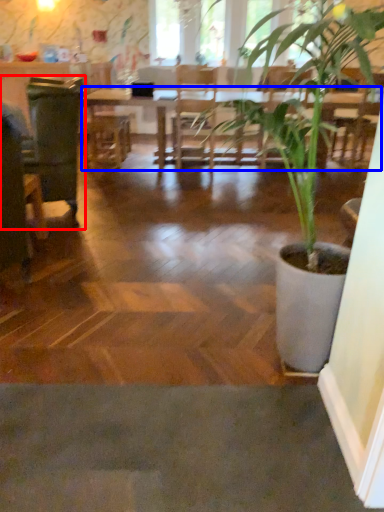
Question: Which point is closer to the camera, swivel chair (highlighted by a red box) or table (highlighted by a blue box)?

Choices:
 (A) swivel chair
 (B) table

Answer: (A)